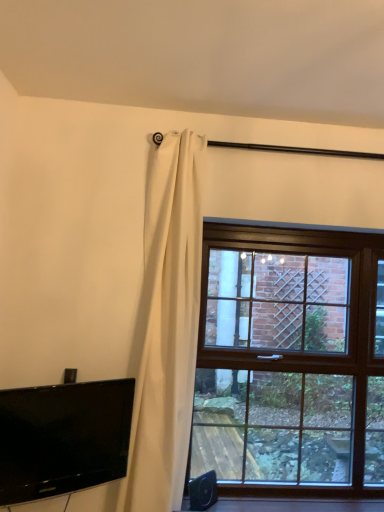
This screenshot has width=384, height=512. Find the location of `white matte curtain at upper left`. white matte curtain at upper left is located at coordinates (166, 327).

In order to face black glossy tv at lower left, should I rotate leftwards or rightwards?

Turn left by 15.906 degrees to look at black glossy tv at lower left.

What are the coordinates of `brown wooden window at right` in the screenshot? It's located at (290, 360).

Image resolution: width=384 pixels, height=512 pixels. Identify the location of white matte curtain at upper left. (166, 327).

Relative to black glossy tv at lower left, is brown wooden window at right in front or behind?

Clearly, brown wooden window at right is behind black glossy tv at lower left.

Between brown wooden window at right and black glossy tv at lower left, which one appears on the right side from the viewer's perspective?

brown wooden window at right.

Who is smaller, brown wooden window at right or black glossy tv at lower left?

black glossy tv at lower left is smaller.

From the image's perspective, is brown wooden window at right positioned above or below black glossy tv at lower left?

Clearly, from the image's perspective, brown wooden window at right is above black glossy tv at lower left.

Would you consider white matte curtain at upper left to be distant from black glossy tv at lower left?

No, white matte curtain at upper left is not far away from black glossy tv at lower left.

Is white matte curtain at upper left to the right of black glossy tv at lower left from the viewer's perspective?

Correct, you'll find white matte curtain at upper left to the right of black glossy tv at lower left.

Which of these two, white matte curtain at upper left or black glossy tv at lower left, stands shorter?

With less height is black glossy tv at lower left.

Is black glossy tv at lower left not near brown wooden window at right?

They are positioned close to each other.

In the scene shown: Is black glossy tv at lower left surrounding brown wooden window at right?

No, brown wooden window at right is not surrounded by black glossy tv at lower left.

From the image's perspective, which object appears higher, black glossy tv at lower left or brown wooden window at right?

brown wooden window at right appears higher in the image.

This screenshot has height=512, width=384. In order to click on window on the right of black glossy tv at lower left in this screenshot , I will do `click(290, 360)`.

Based on the photo, considering the relative positions of white matte curtain at upper left and brown wooden window at right in the image provided, is white matte curtain at upper left in front of brown wooden window at right?

Yes, white matte curtain at upper left is in front of brown wooden window at right.

Where is `window on the right side of white matte curtain at upper left`? Image resolution: width=384 pixels, height=512 pixels. window on the right side of white matte curtain at upper left is located at coordinates (290, 360).

Can you confirm if white matte curtain at upper left is bigger than brown wooden window at right?

Yes, white matte curtain at upper left is bigger than brown wooden window at right.

Which object is wider, white matte curtain at upper left or brown wooden window at right?

With larger width is white matte curtain at upper left.

Measure the distance between black glossy tv at lower left and white matte curtain at upper left.

black glossy tv at lower left and white matte curtain at upper left are 38.19 centimeters apart.

Looking at this image, which of these two, black glossy tv at lower left or white matte curtain at upper left, stands taller?

Standing taller between the two is white matte curtain at upper left.

Considering their positions, is black glossy tv at lower left located in front of or behind white matte curtain at upper left?

In the image, black glossy tv at lower left appears in front of white matte curtain at upper left.

From the picture: Is brown wooden window at right inside or outside of white matte curtain at upper left?

The correct answer is: outside.

Can you confirm if brown wooden window at right is wider than white matte curtain at upper left?

In fact, brown wooden window at right might be narrower than white matte curtain at upper left.

Is point (359, 348) behind point (176, 450)?

Yes, point (359, 348) is farther from viewer.

The width and height of the screenshot is (384, 512). I want to click on television below the brown wooden window at right (from a real-world perspective), so click(x=63, y=438).

You are a GUI agent. You are given a task and a screenshot of the screen. Output one action in this format:
    pyautogui.click(x=<x>, y=<y>)
    Task: Click on the curtain behind the black glossy tv at lower left
    The width and height of the screenshot is (384, 512).
    Given the screenshot: What is the action you would take?
    tap(166, 327)

Which object lies nearer to the anchor point white matte curtain at upper left, brown wooden window at right or black glossy tv at lower left?

black glossy tv at lower left.

Estimate the real-world distances between objects in this image. Which object is further from black glossy tv at lower left, white matte curtain at upper left or brown wooden window at right?

brown wooden window at right.

Based on their spatial positions, is black glossy tv at lower left or brown wooden window at right closer to white matte curtain at upper left?

Based on the image, black glossy tv at lower left appears to be nearer to white matte curtain at upper left.

Which object lies further to the anchor point brown wooden window at right, black glossy tv at lower left or white matte curtain at upper left?

black glossy tv at lower left lies further to brown wooden window at right than the other object.

Which object lies further to the anchor point black glossy tv at lower left, brown wooden window at right or white matte curtain at upper left?

brown wooden window at right is positioned further to the anchor black glossy tv at lower left.

From the image, which object appears to be farther from brown wooden window at right, white matte curtain at upper left or black glossy tv at lower left?

black glossy tv at lower left lies further to brown wooden window at right than the other object.

Find the location of a particular element. This screenshot has height=512, width=384. curtain between black glossy tv at lower left and brown wooden window at right is located at coordinates (166, 327).